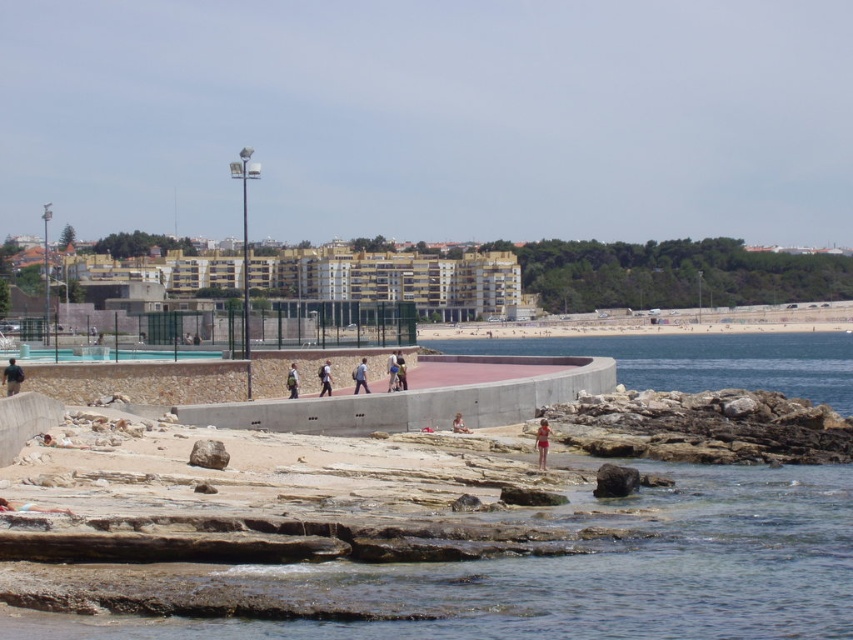
You are a photographer trying to capture a shot of the dark brown rock at lower right and the light blue denim jeans at center. Since you want both subjects to appear in the same frame, which object should you position closer to the camera to ensure they are both visible without cropping?

To include both the dark brown rock at lower right and the light blue denim jeans at center in the same frame, you should position the dark brown rock at lower right closer to the camera. Since it is larger in size compared to the light blue denim jeans at center, moving it forward will help balance their sizes in the composition.

You are standing at the camera position and want to reach both the point at coordinates point [628,492] and point [354,380] in the coastal scene. Which point should you reach first to minimize your walking distance?

You should reach point [628,492] first because it is closer to the camera position than point [354,380], so it requires less walking distance.

You are a photographer standing on the walkway and want to take a photo of the light blue denim shorts at center and the matte black backpack at center. Which object should you focus on first if you want to capture both in sharp focus?

The light blue denim shorts at center is above the matte black backpack at center, so you should focus on the matte black backpack at center first since it is closer to you.